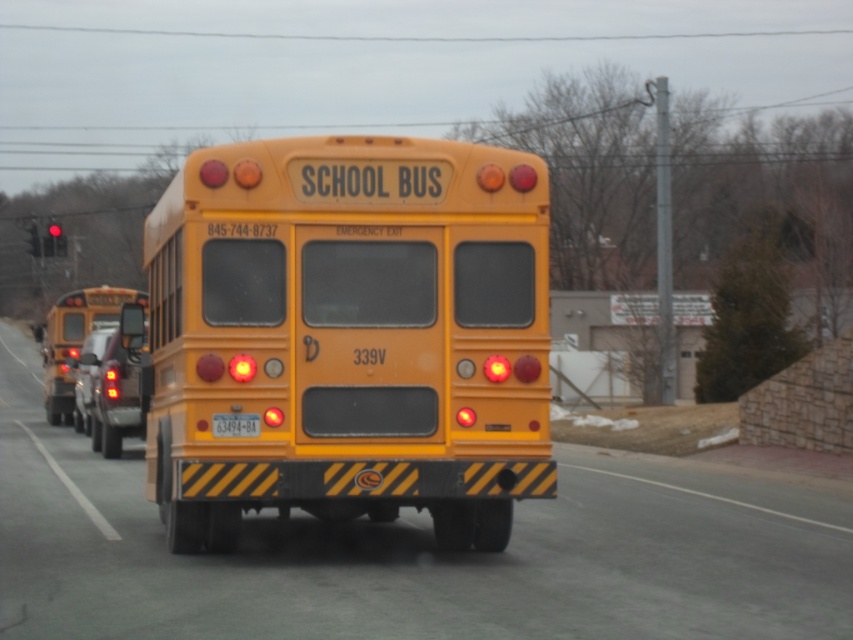
You are a driver approaching a yellow matte school bus at rear from behind. You notice a yellow matte license plate at center. Where is the license plate located relative to the school bus?

The yellow matte license plate at center is positioned underneath the yellow matte school bus at rear.

You are a driver behind the yellow matte school bus at rear and want to pass it on a two lane road. The yellow matte license plate at center is in your lane. Can you safely pass the bus without crossing into the oncoming traffic lane?

The yellow matte school bus at rear is wider than the yellow matte license plate at center, so passing it without crossing into the oncoming traffic lane may not be possible since the bus requires more space and the license plate is in your lane.

You are a driver approaching the yellow school bus from behind. You see two points marked on the bus rear. The first point is at coordinates point (213, 429) and the second is at point (55, 252). Which point is closer to the front of the bus?

Point (213, 429) is in front of point (55, 252), so the first point is closer to the front of the bus.